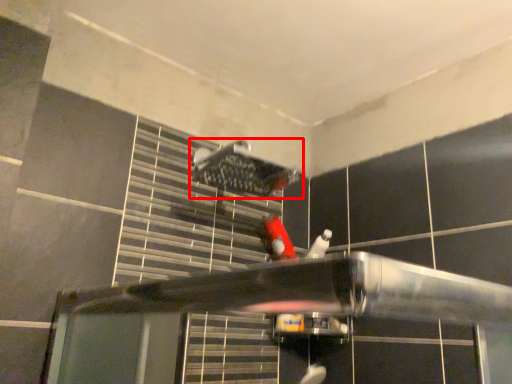
Question: From the image, what is the correct spatial relationship of shower (annotated by the red box) in relation to person?

Choices:
 (A) left
 (B) right

Answer: (A)